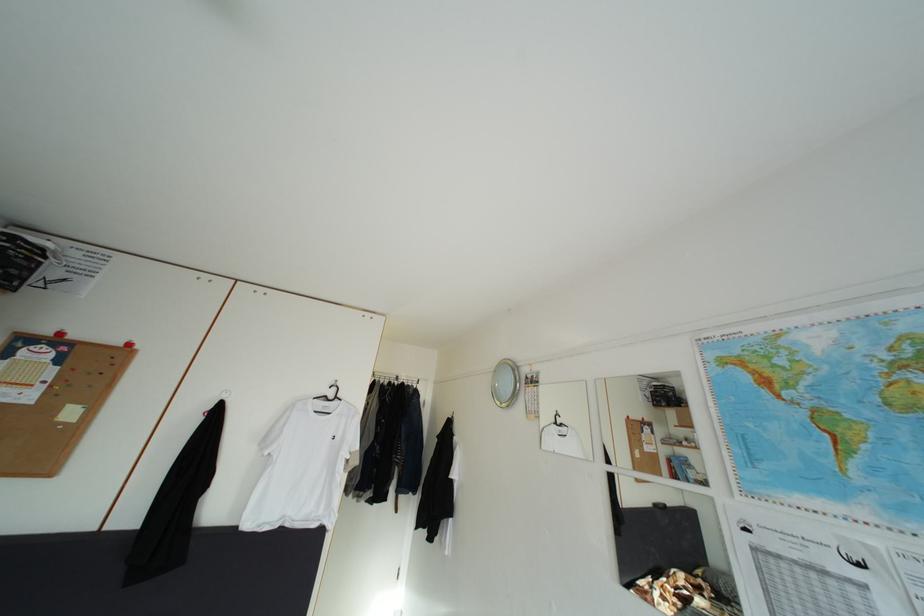
At what (x,y) coordinates should I click in order to perform the action: click on white clothes hanger. Please return your answer as a coordinate pair (x, y). The width and height of the screenshot is (924, 616). Looking at the image, I should click on (331, 392).